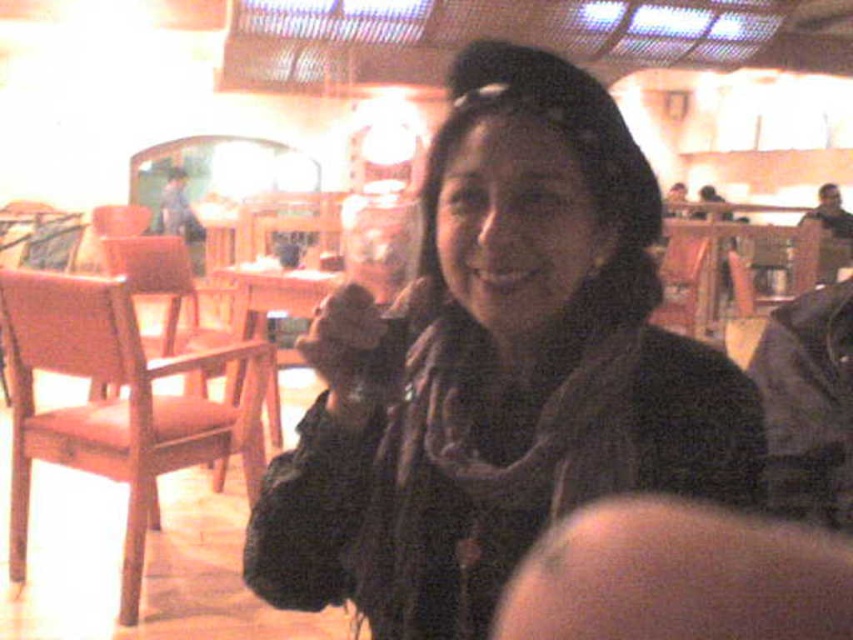
You are a photographer adjusting your camera settings to capture the black matte scarf at center in focus. The camera has a fixed focal length and aperture. What should you adjust to ensure the scarf is sharply focused?

To ensure the black matte scarf at center is sharply focused, adjust the camera focus ring to match the distance corresponding to the coordinates provided for the scarf, which are at point [503,371].

You are a photographer trying to capture a closeup of the black matte scarf at center and the wooden table at center. Which object should you focus on first to ensure it appears sharp in the photo?

The black matte scarf at center is closer to the viewer than the wooden table at center, so you should focus on the black matte scarf at center first to ensure it appears sharp.